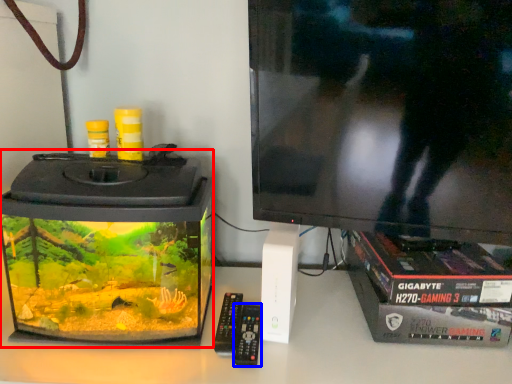
Question: Which object is further to the camera taking this photo, appliance (highlighted by a red box) or control (highlighted by a blue box)?

Choices:
 (A) appliance
 (B) control

Answer: (B)